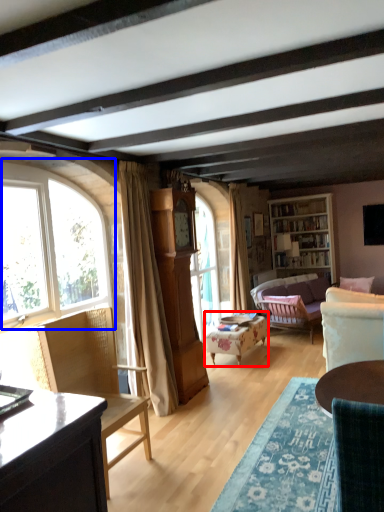
Question: Which point is further to the camera, chair (highlighted by a red box) or window (highlighted by a blue box)?

Choices:
 (A) chair
 (B) window

Answer: (A)